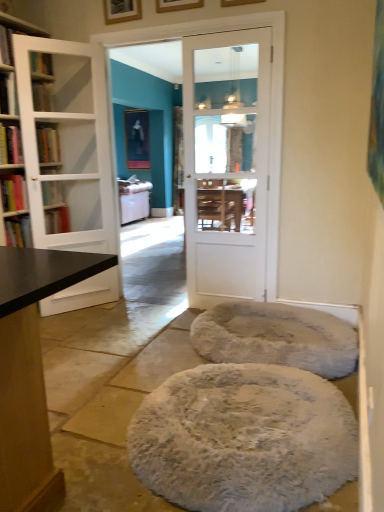
This screenshot has height=512, width=384. Find the location of `blank space to the left of white fluffy cat bed at center`. blank space to the left of white fluffy cat bed at center is located at coordinates [128, 357].